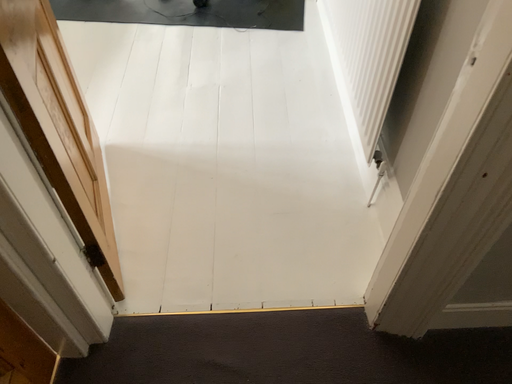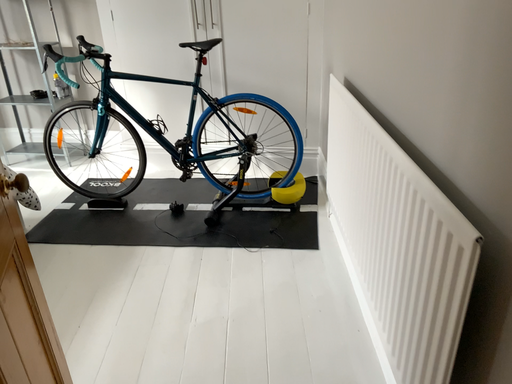
Question: How did the camera likely rotate when shooting the video?

Choices:
 (A) rotated downward
 (B) rotated upward

Answer: (B)